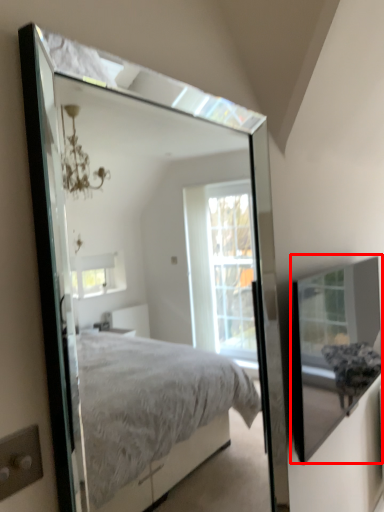
Question: From the image's perspective, what is the correct spatial relationship of glass box (annotated by the red box) in relation to mirror?

Choices:
 (A) below
 (B) above

Answer: (A)